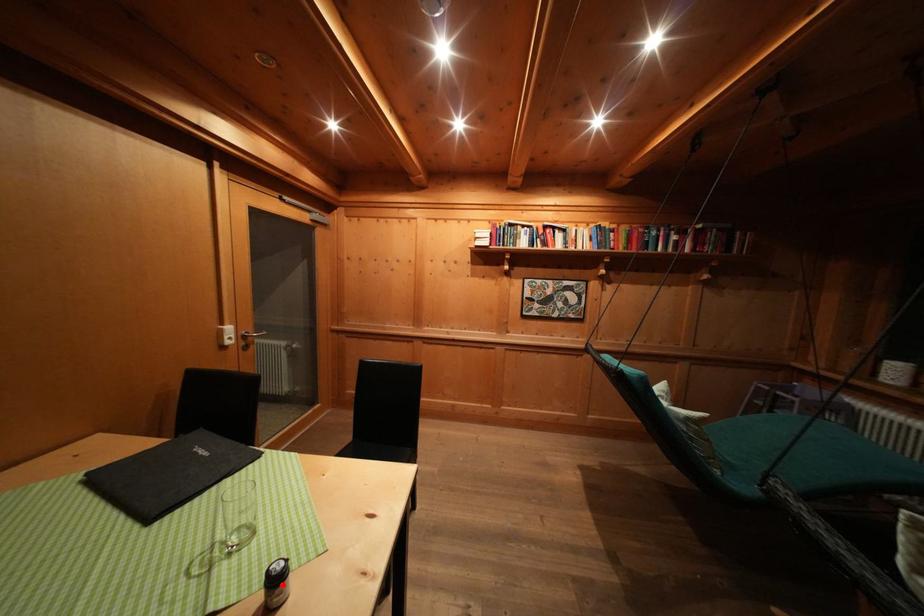
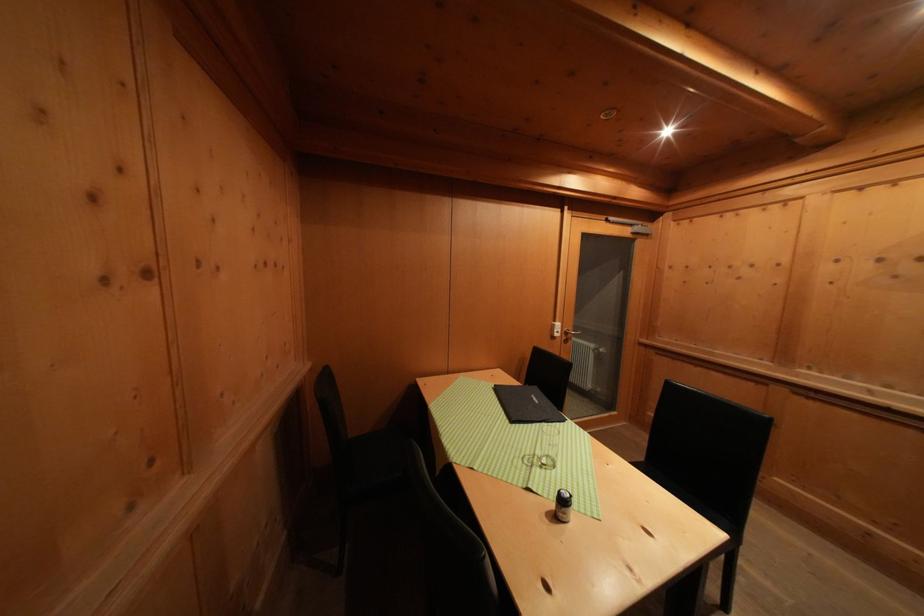
Find the pixel in the second image that matches the highlighted location in the first image.

(569, 506)